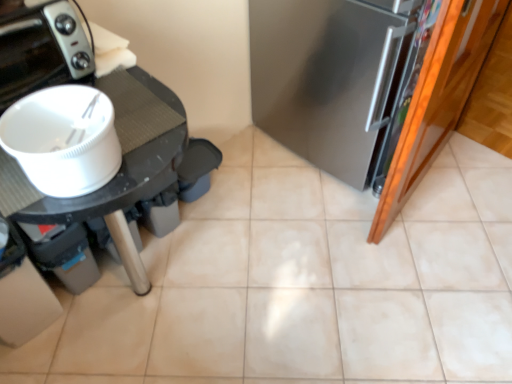
Question: Considering the relative sizes of satin silver refrigerator at right and beige ceramic tile at center in the image provided, is satin silver refrigerator at right taller than beige ceramic tile at center?

Choices:
 (A) yes
 (B) no

Answer: (A)

Question: Is satin silver refrigerator at right smaller than beige ceramic tile at center?

Choices:
 (A) yes
 (B) no

Answer: (B)

Question: Is satin silver refrigerator at right positioned before beige ceramic tile at center?

Choices:
 (A) no
 (B) yes

Answer: (A)

Question: Is beige ceramic tile at center at the back of satin silver refrigerator at right?

Choices:
 (A) yes
 (B) no

Answer: (B)

Question: From a real-world perspective, does satin silver refrigerator at right stand above beige ceramic tile at center?

Choices:
 (A) no
 (B) yes

Answer: (B)

Question: In terms of height, does satin silver refrigerator at right look taller or shorter compared to black glossy toaster at upper left?

Choices:
 (A) tall
 (B) short

Answer: (A)

Question: From a real-world perspective, is satin silver refrigerator at right positioned above or below black glossy toaster at upper left?

Choices:
 (A) above
 (B) below

Answer: (B)

Question: From the image's perspective, relative to black glossy toaster at upper left, is satin silver refrigerator at right above or below?

Choices:
 (A) above
 (B) below

Answer: (A)

Question: Looking at the image, does satin silver refrigerator at right seem bigger or smaller compared to black glossy toaster at upper left?

Choices:
 (A) big
 (B) small

Answer: (A)

Question: From the image's perspective, is black glossy toaster at upper left positioned above or below beige ceramic tile at center?

Choices:
 (A) above
 (B) below

Answer: (A)

Question: Considering the positions of black glossy toaster at upper left and beige ceramic tile at center in the image, is black glossy toaster at upper left wider or thinner than beige ceramic tile at center?

Choices:
 (A) wide
 (B) thin

Answer: (B)

Question: Visually, is black glossy toaster at upper left positioned to the left or to the right of beige ceramic tile at center?

Choices:
 (A) right
 (B) left

Answer: (B)

Question: Is point (82, 57) positioned closer to the camera than point (411, 223)?

Choices:
 (A) closer
 (B) farther

Answer: (A)

Question: Is point (122, 236) positioned closer to the camera than point (64, 4)?

Choices:
 (A) farther
 (B) closer

Answer: (A)

Question: Do you think white plastic table at left is within black glossy toaster at upper left, or outside of it?

Choices:
 (A) inside
 (B) outside

Answer: (B)